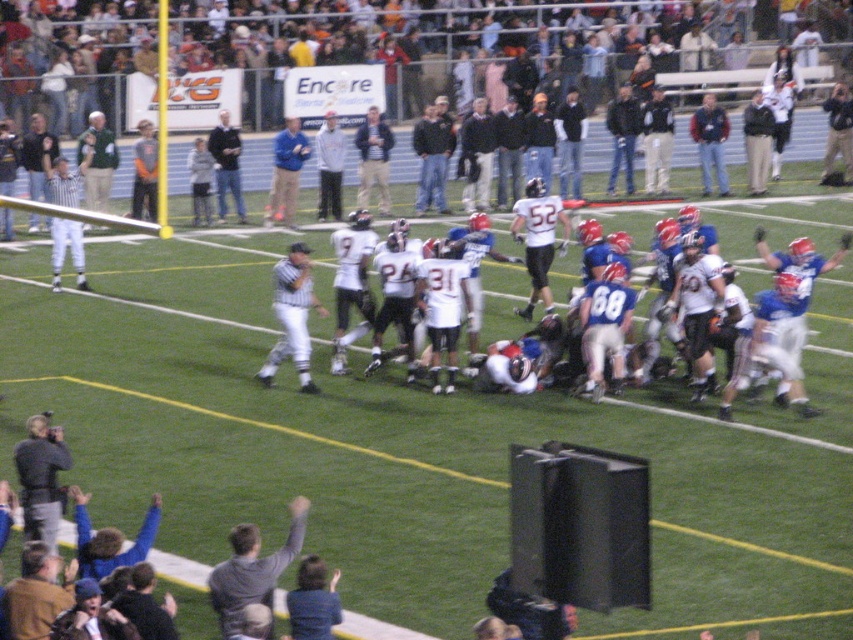
You are a spectator at the football game and want to take a photo of both the blue denim jeans at center and the dark blue jacket at center. Which one should you focus on first to ensure both are in the frame?

You should focus on the blue denim jeans at center first because the dark blue jacket at center is behind it, so positioning the camera to include the front object ensures the one behind is also captured.

You are a spectator at the football game and notice the white striped referee at left and the blue denim jeans at center. Which of these two objects appears larger in the image?

The blue denim jeans at center appears larger than the white striped referee at left in the image.